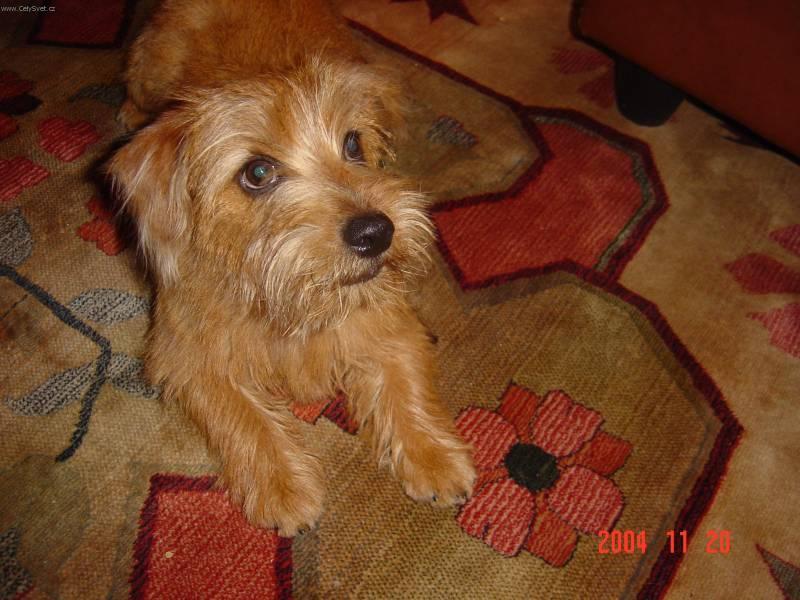
Find the location of `carpet`. carpet is located at coordinates (594, 388).